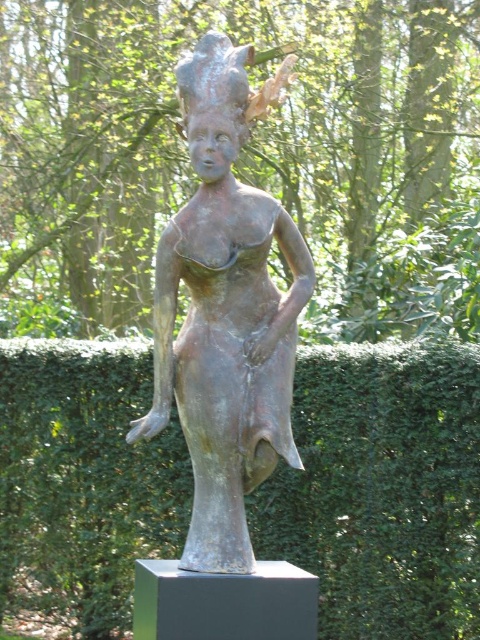
Does green leafy hedge at center have a larger size compared to bronze statue at center?

Indeed, green leafy hedge at center has a larger size compared to bronze statue at center.

Looking at this image, measure the distance from green leafy hedge at center to bronze statue at center.

green leafy hedge at center is 3.27 meters from bronze statue at center.

Where is `green leafy hedge at center`? The image size is (480, 640). green leafy hedge at center is located at coordinates (383, 490).

I want to click on green leafy hedge at center, so pos(383,490).